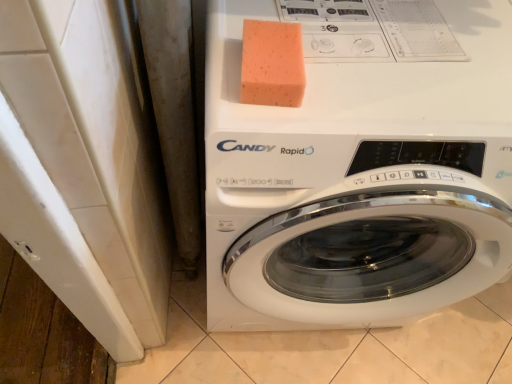
Find the location of `free point behind orange sponge at upper center`. free point behind orange sponge at upper center is located at coordinates (296, 16).